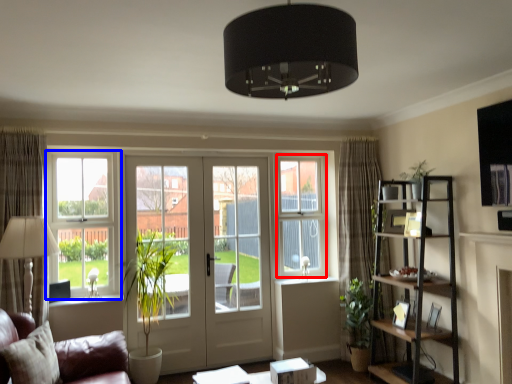
Question: Which object is closer to the camera taking this photo, window screen (highlighted by a red box) or window (highlighted by a blue box)?

Choices:
 (A) window screen
 (B) window

Answer: (B)